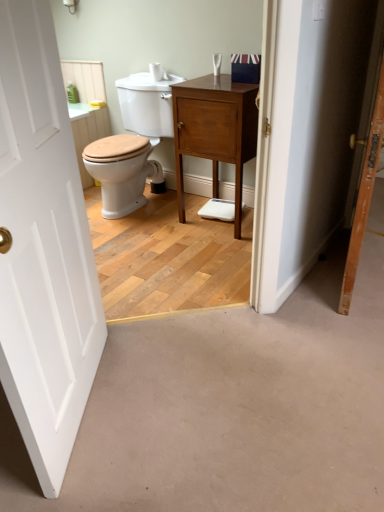
This screenshot has height=512, width=384. In order to click on free spot to the right of white wooden door at left, which is counted as the second door, starting from the right in this screenshot , I will do `click(191, 413)`.